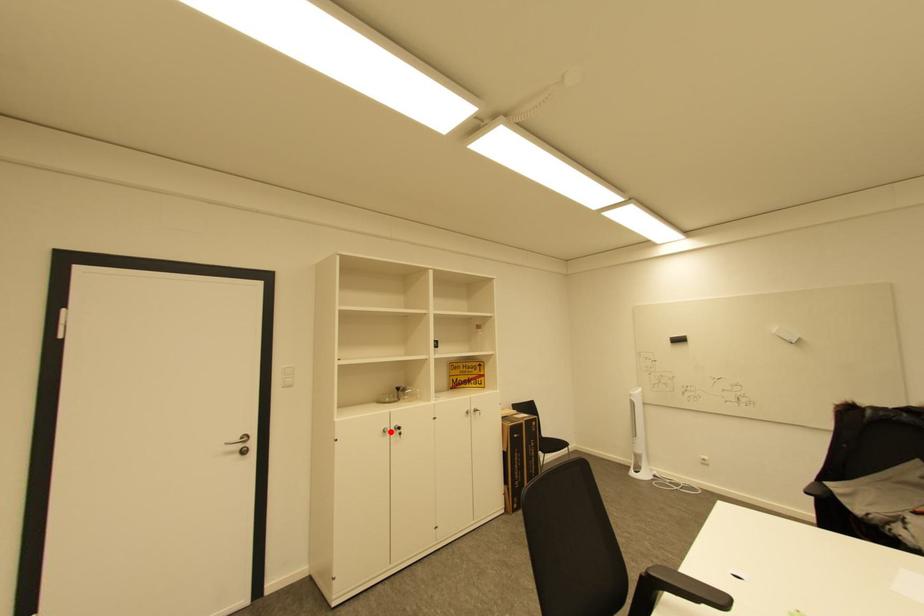
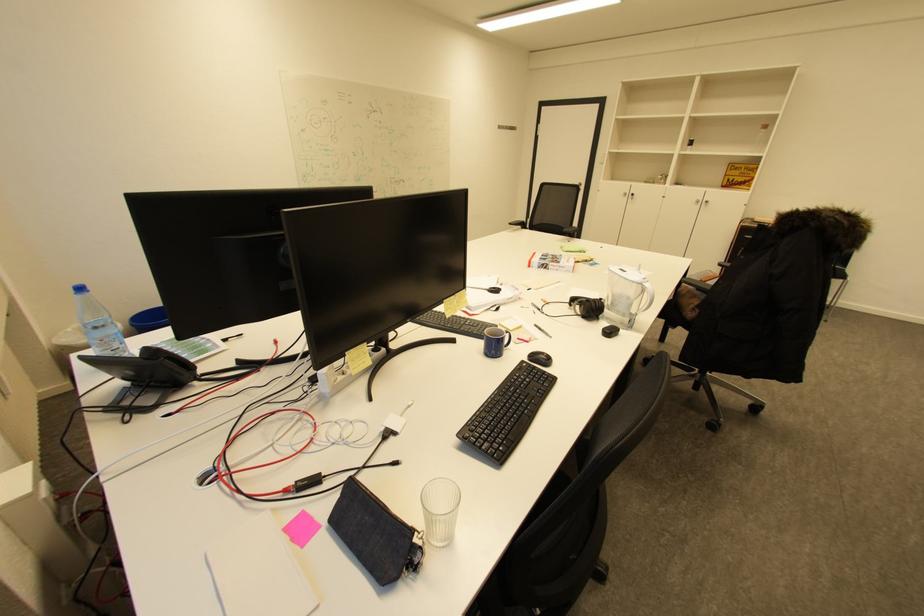
The point at the highlighted location is marked in the first image. Where is the corresponding point in the second image?

(630, 195)